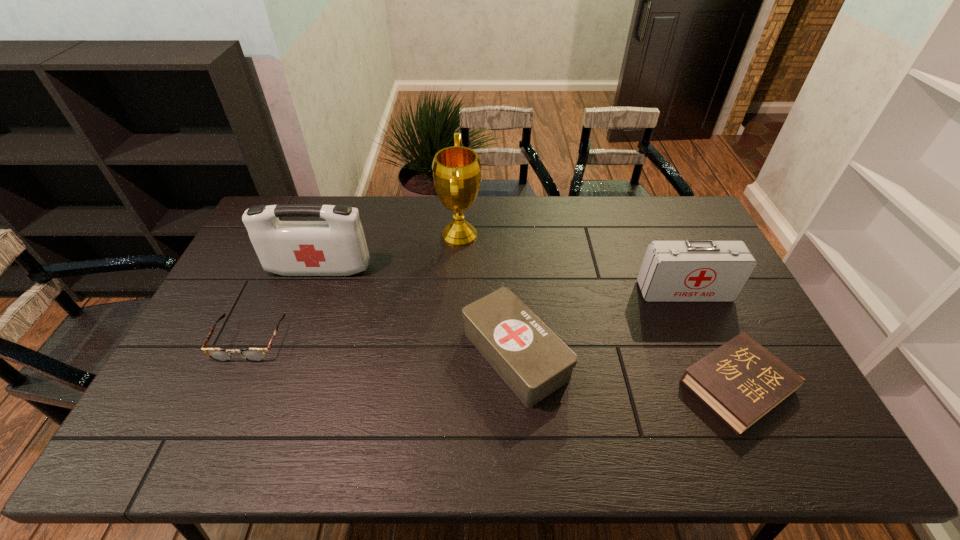
Find the location of a particular element. This screenshot has height=540, width=960. free spot located on the front side of the farthest first-aid kit is located at coordinates (311, 291).

Find the location of `free space located 0.130m on the front-facing side of the third farthest object`. free space located 0.130m on the front-facing side of the third farthest object is located at coordinates (705, 336).

Identify the location of free spot located on the right of the shortest first-aid kit. The image size is (960, 540). (660, 354).

Identify the location of free space located on the frame of the spectacles. This screenshot has height=540, width=960. (196, 459).

In order to click on free space located on the left of the hardback book in this screenshot , I will do `click(608, 386)`.

This screenshot has height=540, width=960. What are the coordinates of `object that is at the far edge` in the screenshot? It's located at (456, 170).

The width and height of the screenshot is (960, 540). What are the coordinates of `object that is at the near edge` in the screenshot? It's located at (741, 381).

Where is `the first-aid kit present at the left edge`? The height and width of the screenshot is (540, 960). the first-aid kit present at the left edge is located at coordinates (336, 247).

Locate an element on the screen. The height and width of the screenshot is (540, 960). spectacles that is positioned at the left edge is located at coordinates (218, 354).

Find the location of a particular element. the first-aid kit situated at the right edge is located at coordinates (692, 270).